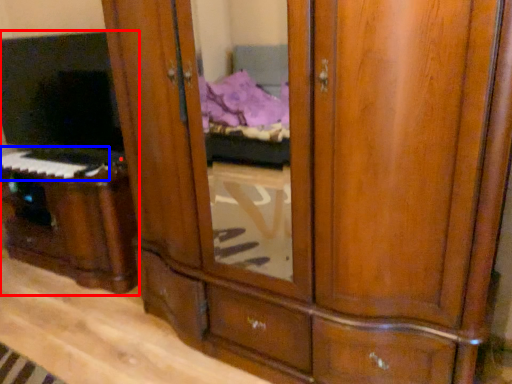
Question: Which object appears farthest to the camera in this image, entertainment center (highlighted by a red box) or musical keyboard (highlighted by a blue box)?

Choices:
 (A) entertainment center
 (B) musical keyboard

Answer: (B)